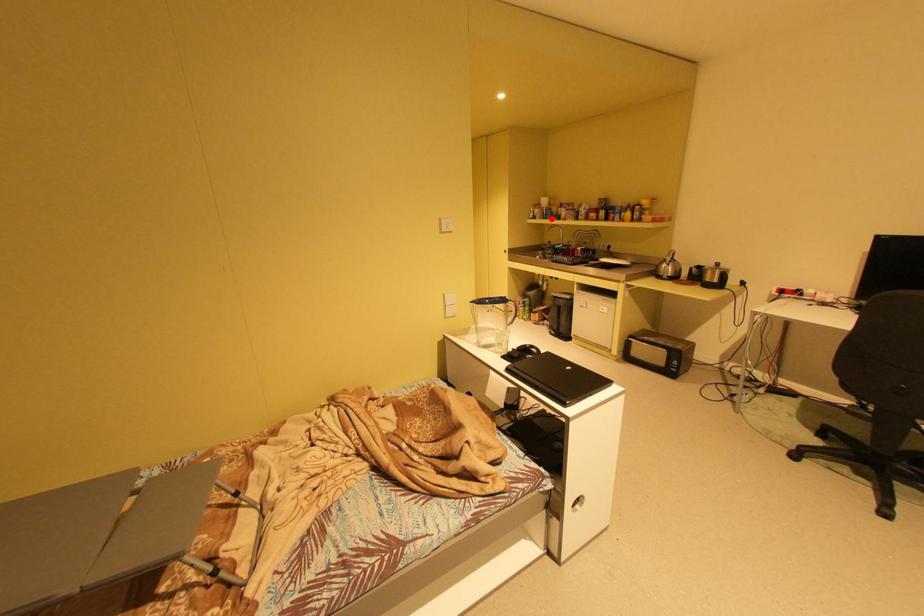
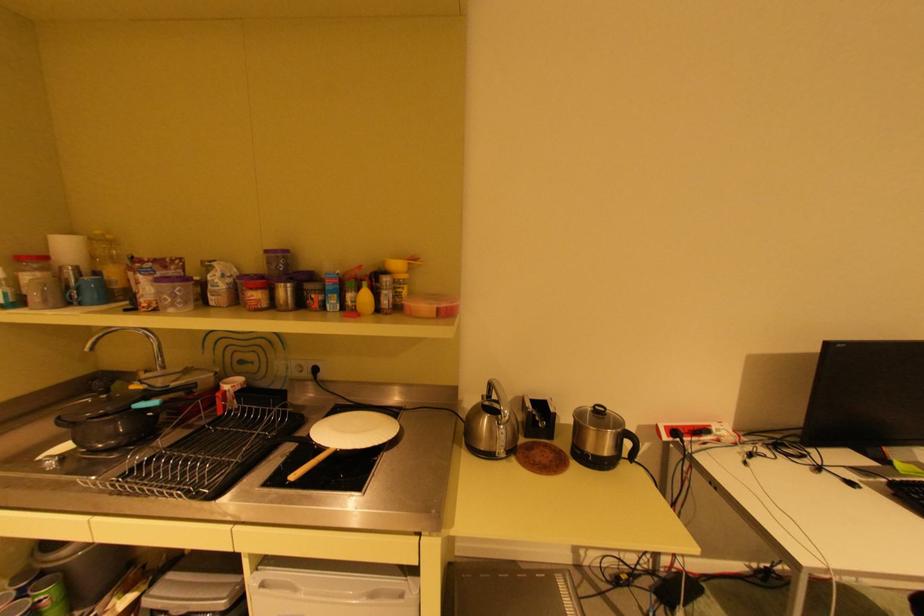
Question: I am providing you with two images of the same scene from different viewpoints. A red point is marked on the first image. At the location where the point appears in image 1, is it still visible in image 2?

Choices:
 (A) Yes
 (B) No

Answer: (A)